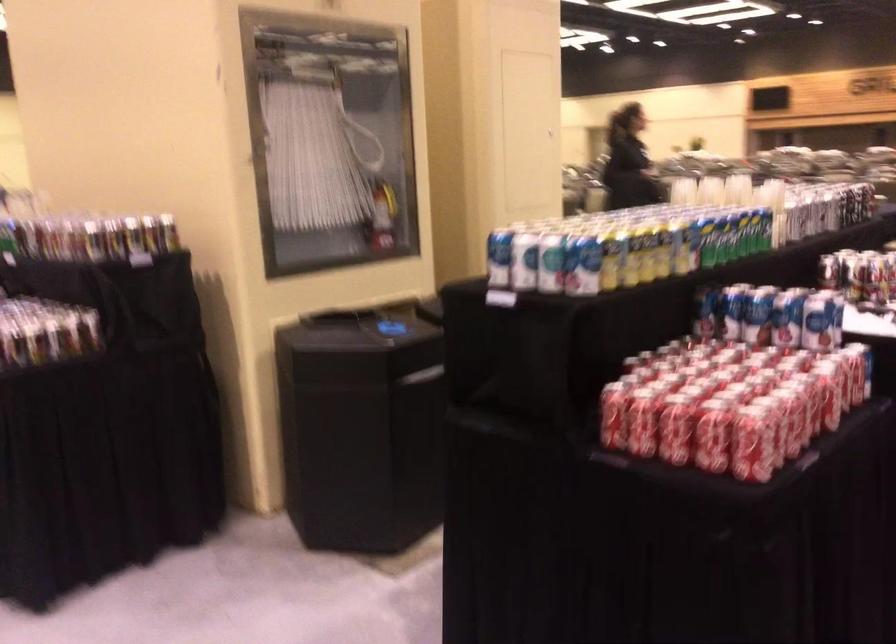
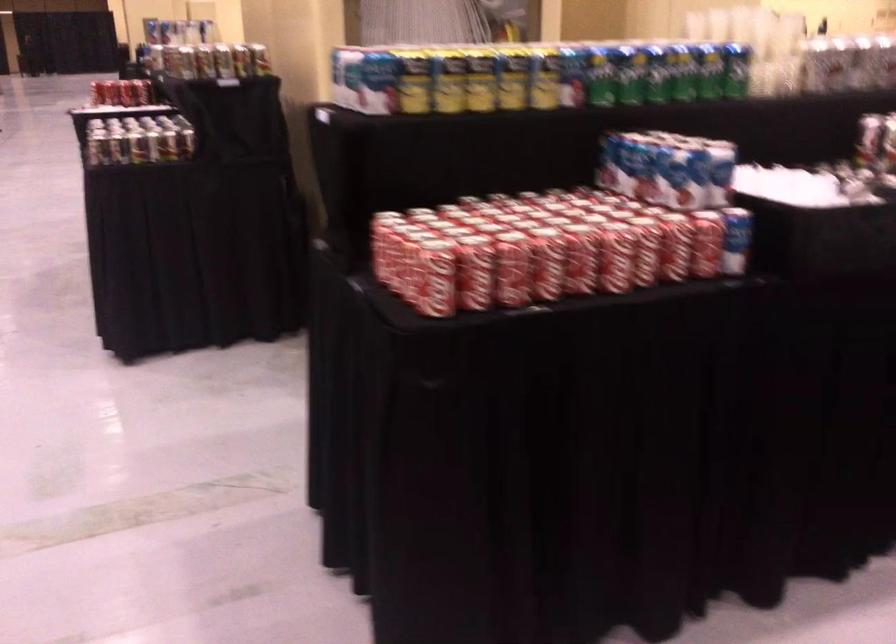
Question: What movement of the cameraman would produce the second image?

Choices:
 (A) Left
 (B) Right
 (C) Forward
 (D) Backward

Answer: (B)